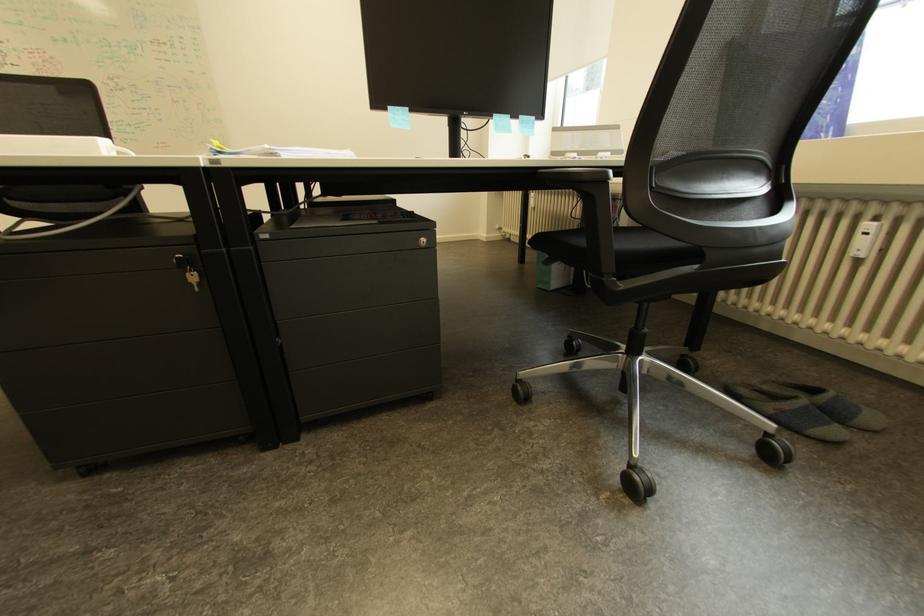
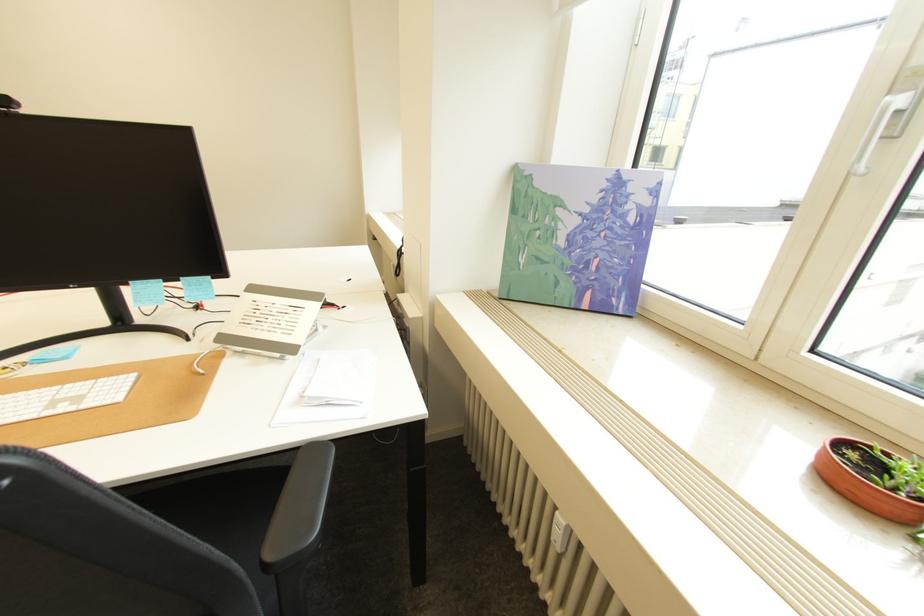
Question: The images are taken continuously from a first-person perspective. In which direction are you moving?

Choices:
 (A) Left
 (B) Right
 (C) Forward
 (D) Backward

Answer: (B)